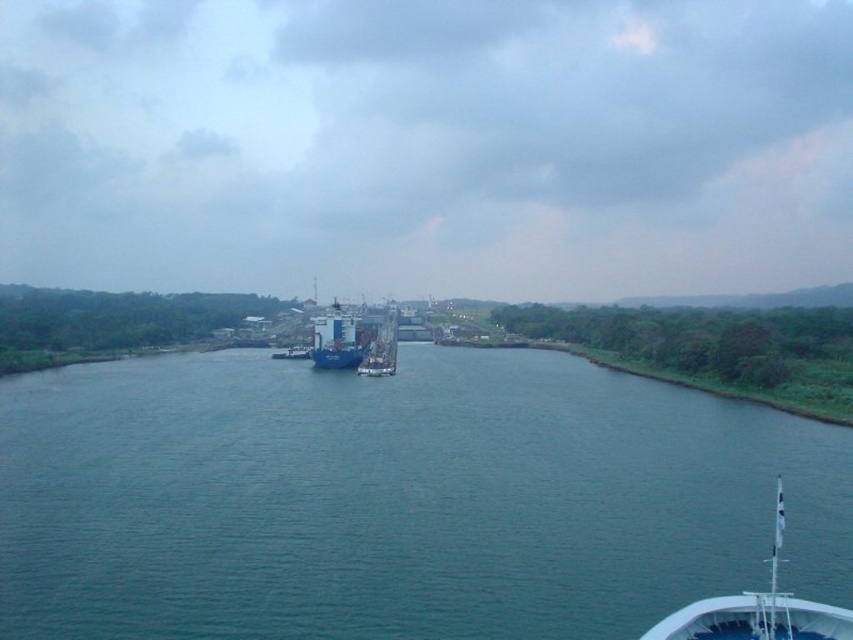
Is white glossy boat at lower right above blue matte container ship at center?

Incorrect, white glossy boat at lower right is not positioned above blue matte container ship at center.

Between white glossy boat at lower right and blue matte container ship at center, which one is positioned higher?

blue matte container ship at center

Describe the element at coordinates (757, 609) in the screenshot. I see `white glossy boat at lower right` at that location.

Identify the location of white glossy boat at lower right. Image resolution: width=853 pixels, height=640 pixels. (757, 609).

Which is behind, point (335, 572) or point (732, 636)?

Positioned behind is point (335, 572).

Can you confirm if blue water at center is positioned above white glossy boat at lower right?

Yes.

In order to click on blue water at center in this screenshot , I will do `click(397, 499)`.

Between blue water at center and blue matte container ship at center, which one is positioned lower?

blue water at center

Measure the distance between point (306, 371) and camera.

A distance of 417.95 feet exists between point (306, 371) and camera.

Where is `blue water at center`? This screenshot has width=853, height=640. blue water at center is located at coordinates (397, 499).